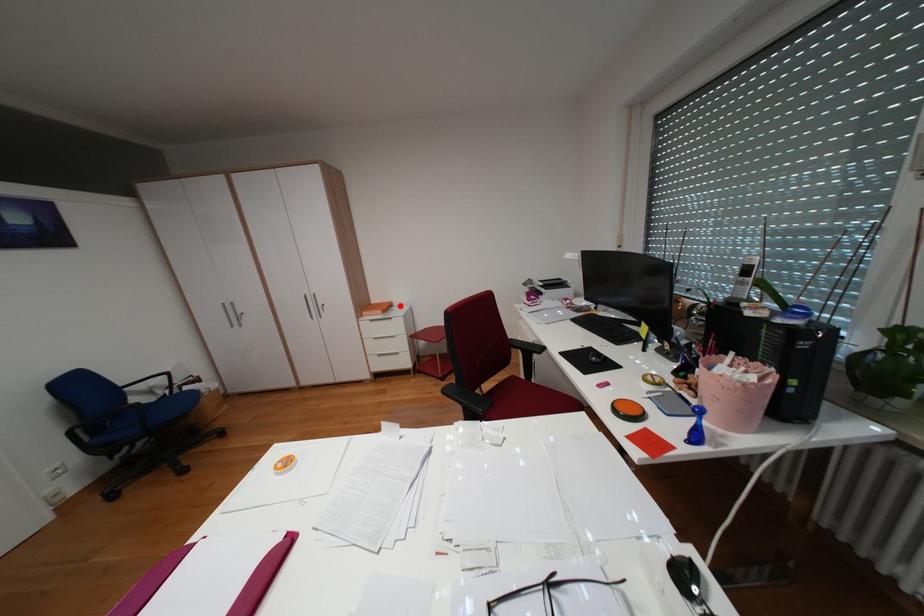
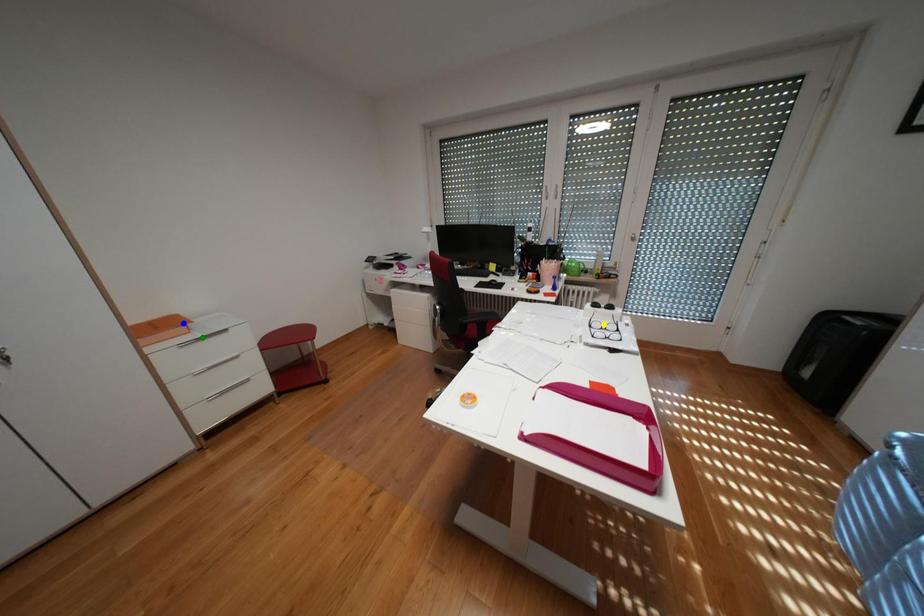
Question: I am providing you with two images of the same scene from different viewpoints. A red point is marked on the first image. You are given multiple points on the second image. Which spot in image 2 lines up with the point in image 1?

Choices:
 (A) blue point
 (B) green point
 (C) yellow point

Answer: (A)